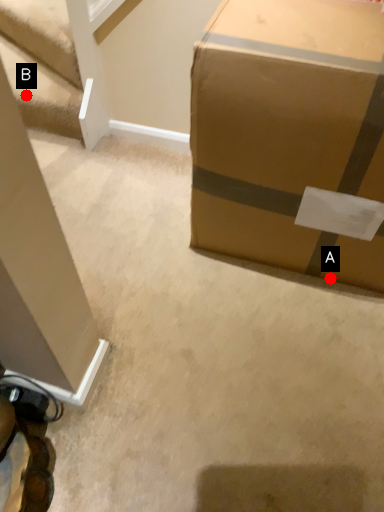
Question: Two points are circled on the image, labeled by A and B beside each circle. Which point is closer to the camera?

Choices:
 (A) A is closer
 (B) B is closer

Answer: (A)